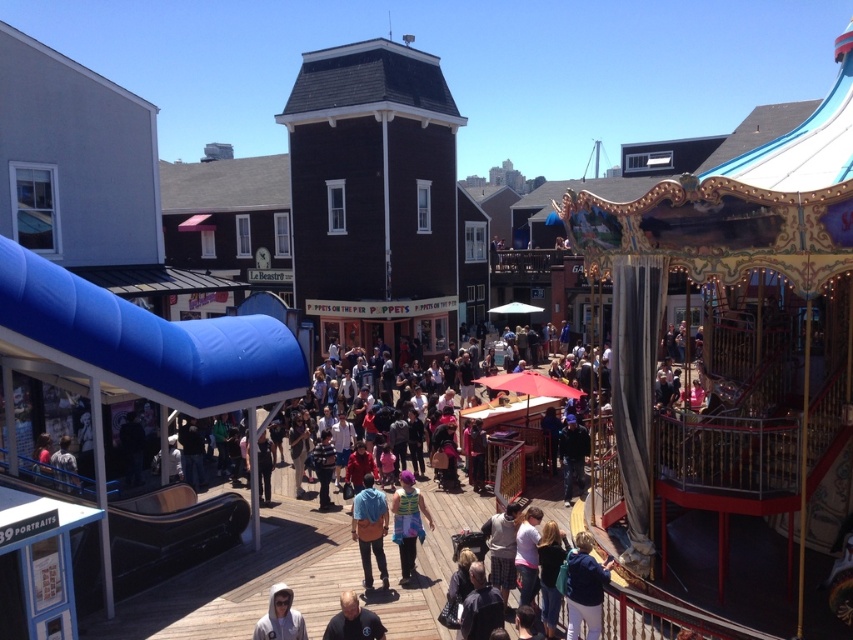
Can you confirm if blue denim jacket at center is positioned to the right of shiny purple hair at center?

No, blue denim jacket at center is not to the right of shiny purple hair at center.

Is blue denim jacket at center shorter than shiny purple hair at center?

Yes.

Is point (363, 524) positioned behind point (409, 573)?

That is False.

I want to click on blue denim jacket at center, so click(x=370, y=529).

Does point (585, 620) come farther from viewer compared to point (378, 552)?

No, (585, 620) is closer to viewer.

Between blue denim jacket at lower right and blue denim jacket at center, which one appears on the left side from the viewer's perspective?

blue denim jacket at center

Does point (572, 636) come behind point (358, 506)?

No, it is in front of (358, 506).

At what (x,y) coordinates should I click in order to perform the action: click on blue denim jacket at lower right. Please return your answer as a coordinate pair (x, y). Looking at the image, I should click on (585, 588).

Can you confirm if blue denim jacket at lower right is positioned above shiny purple hair at center?

No, blue denim jacket at lower right is not above shiny purple hair at center.

Which is more to the right, blue denim jacket at lower right or shiny purple hair at center?

blue denim jacket at lower right

This screenshot has width=853, height=640. Describe the element at coordinates (585, 588) in the screenshot. I see `blue denim jacket at lower right` at that location.

Locate an element on the screen. This screenshot has width=853, height=640. blue denim jacket at lower right is located at coordinates [x=585, y=588].